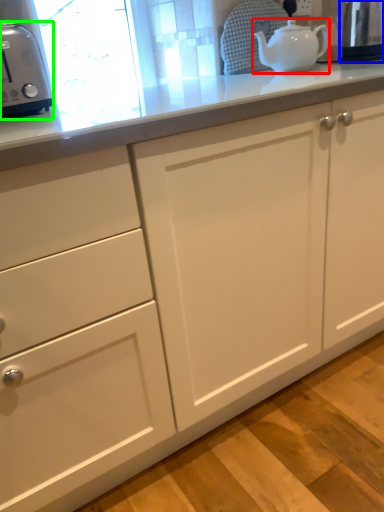
Question: Considering the real-world distances, which object is farthest from teapot (highlighted by a red box)? appliance (highlighted by a blue box) or toaster (highlighted by a green box)?

Choices:
 (A) appliance
 (B) toaster

Answer: (B)